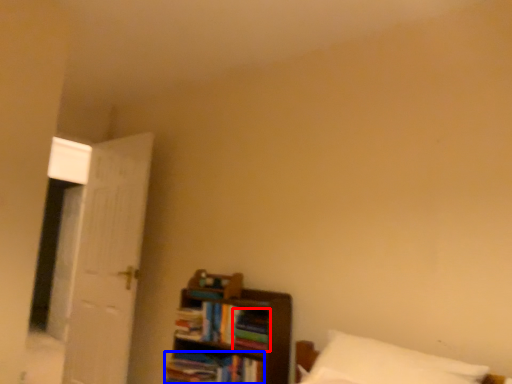
Question: Among these objects, which one is farthest to the camera, book (highlighted by a red box) or book (highlighted by a blue box)?

Choices:
 (A) book
 (B) book

Answer: (A)